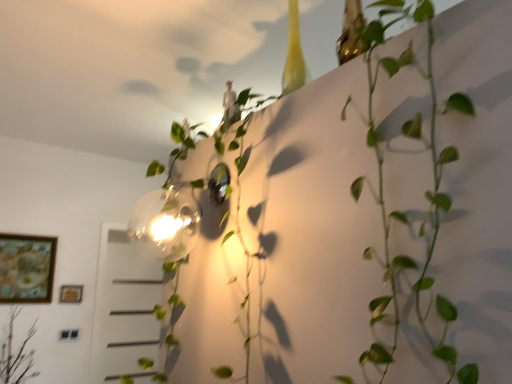
Question: In terms of height, does green matte plant at lower left, the 3th plant from the right, look taller or shorter compared to wooden framed artwork at lower left, placed as the 2th picture frame when sorted from right to left?

Choices:
 (A) short
 (B) tall

Answer: (B)

Question: Looking at their shapes, would you say green matte plant at lower left, which is the 1th plant in left-to-right order, is wider or thinner than wooden framed artwork at lower left, placed as the 2th picture frame when sorted from right to left?

Choices:
 (A) wide
 (B) thin

Answer: (A)

Question: Which object is positioned closest to the wooden framed artwork at lower left, placed as the 2th picture frame when sorted from right to left?

Choices:
 (A) gold metallic picture frame at lower left, marked as the 1th picture frame in a right-to-left arrangement
 (B) green matte plant at lower left, which is the 1th plant in left-to-right order
 (C) green matte plant at upper right, marked as the 3th plant in a left-to-right arrangement
 (D) green leafy plant at upper center, marked as the second plant in a back-to-front arrangement

Answer: (A)

Question: Considering the real-world distances, which object is farthest from the wooden framed artwork at lower left, placed as the 2th picture frame when sorted from right to left?

Choices:
 (A) green matte plant at upper right, the first plant from the right
 (B) gold metallic picture frame at lower left, which is the 2th picture frame in left-to-right order
 (C) green matte plant at lower left, which is the 1th plant in left-to-right order
 (D) green leafy plant at upper center, the second plant positioned from the right

Answer: (A)